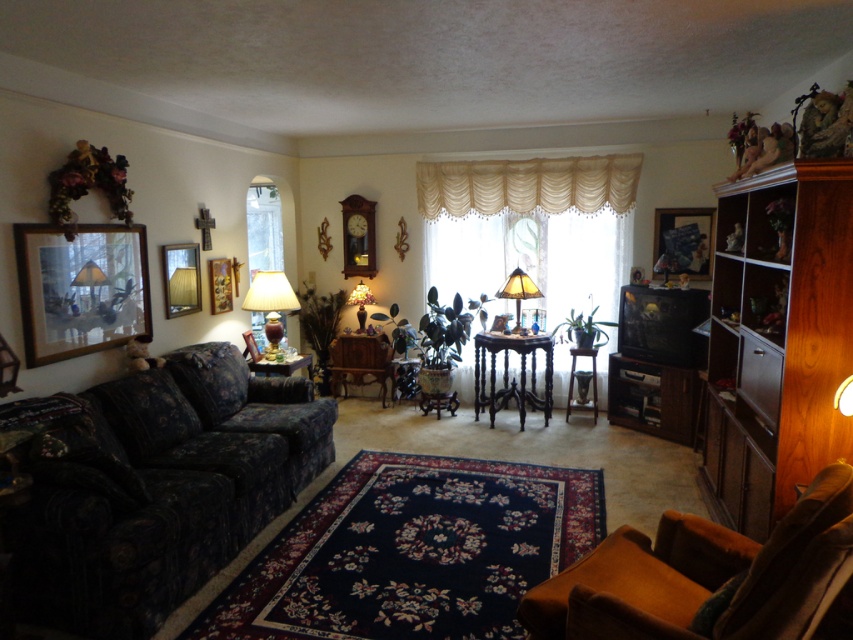
Is brown suede armchair at lower right taller than matte floral-patterned lampshade at center?

Indeed, brown suede armchair at lower right has a greater height compared to matte floral-patterned lampshade at center.

Is brown suede armchair at lower right smaller than matte floral-patterned lampshade at center?

Actually, brown suede armchair at lower right might be larger than matte floral-patterned lampshade at center.

Locate an element on the screen. brown suede armchair at lower right is located at coordinates 705,576.

Does point (679, 253) lie in front of point (445, 378)?

Yes, point (679, 253) is in front of point (445, 378).

Is wooden picture frame at upper right further to camera compared to wooden armchair at center?

No, it is in front of wooden armchair at center.

Which is in front, point (663, 241) or point (442, 364)?

Point (663, 241)

Where is `wooden picture frame at upper right`? wooden picture frame at upper right is located at coordinates (682, 241).

Which is more to the right, tinted glass lamp at center or wooden side table at lower left?

tinted glass lamp at center

Is point (517, 276) more distant than point (308, 378)?

No.

Which is behind, point (520, 282) or point (267, 364)?

The point (520, 282) is more distant.

This screenshot has width=853, height=640. What are the coordinates of `tinted glass lamp at center` in the screenshot? It's located at (518, 291).